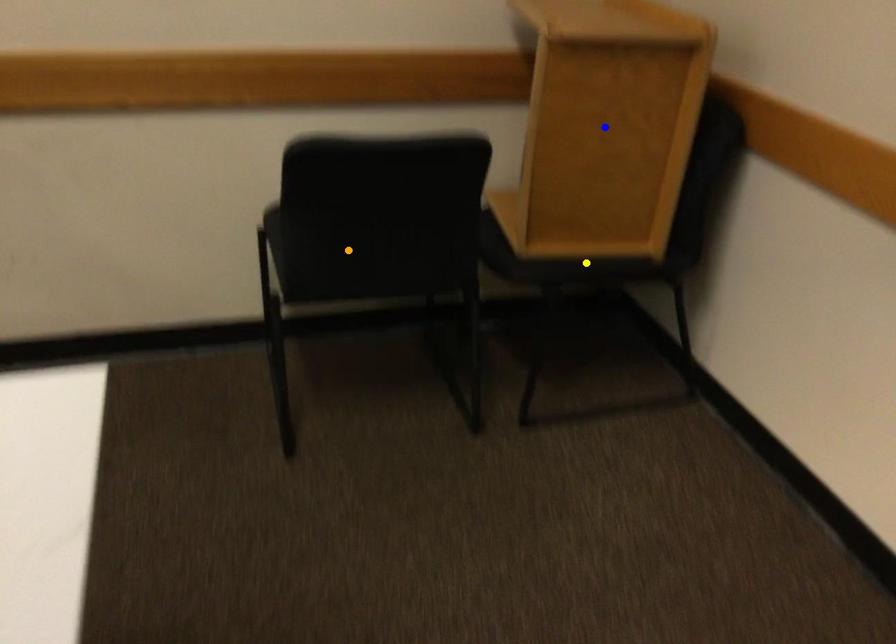
Order these from nearest to farthest:
orange point, yellow point, blue point

1. orange point
2. blue point
3. yellow point